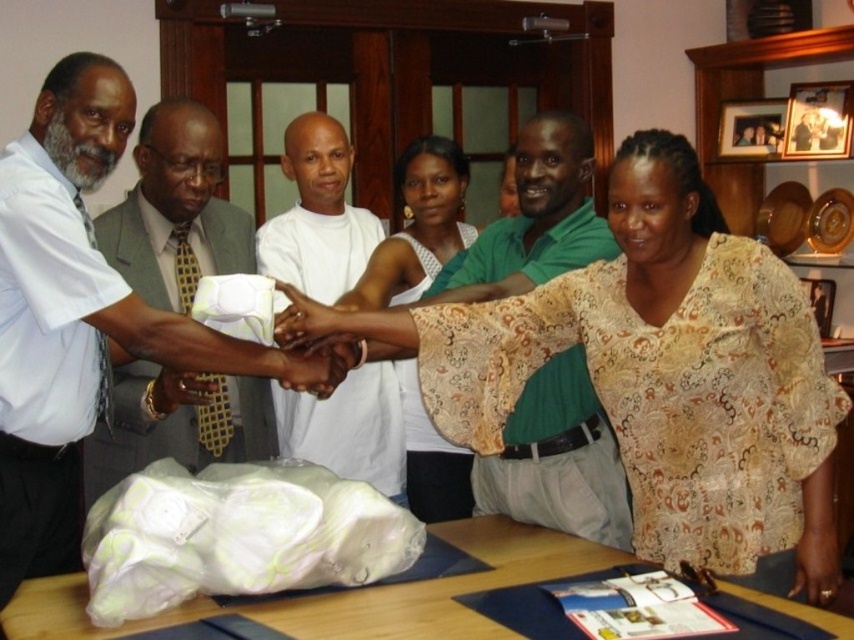
Question: Among these points, which one is farthest from the camera?

Choices:
 (A) (317, 388)
 (B) (554, 508)
 (C) (250, 508)
 (D) (42, 248)

Answer: (B)

Question: Is patterned fabric blouse at center to the right of matte white glove at center from the viewer's perspective?

Choices:
 (A) no
 (B) yes

Answer: (B)

Question: From the image, what is the correct spatial relationship of white cotton shirt at center in relation to smooth skin handshake at center?

Choices:
 (A) below
 (B) above

Answer: (B)

Question: Where is white matte shirt at center located in relation to white lace blouse at center in the image?

Choices:
 (A) left
 (B) right

Answer: (A)

Question: Which point is closer to the camera?

Choices:
 (A) green matte shirt at center
 (B) wooden table at lower center
 (C) white matte shirt at center
 (D) matte gold bracelet at center

Answer: (B)

Question: Estimate the real-world distances between objects in this image. Which object is farther from the wooden table at lower center?

Choices:
 (A) green matte shirt at center
 (B) light brown suit jacket at left

Answer: (B)